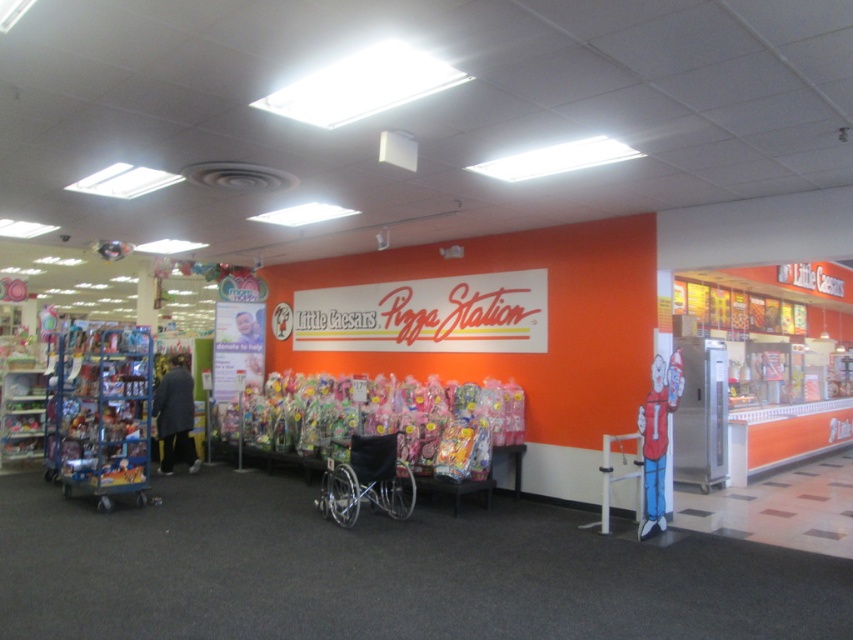
Which is more to the right, black plastic wheelchair at center or dark gray coat at left?

black plastic wheelchair at center

Does black plastic wheelchair at center appear on the right side of dark gray coat at left?

Correct, you'll find black plastic wheelchair at center to the right of dark gray coat at left.

Which is behind, point (334, 513) or point (183, 432)?

The point (183, 432) is behind.

You are a GUI agent. You are given a task and a screenshot of the screen. Output one action in this format:
    pyautogui.click(x=<x>, y=<y>)
    Task: Click on the black plastic wheelchair at center
    
    Given the screenshot: What is the action you would take?
    pyautogui.click(x=367, y=481)

Does translucent plastic toys at center have a larger size compared to dark gray coat at left?

Correct, translucent plastic toys at center is larger in size than dark gray coat at left.

Does point (347, 400) come in front of point (184, 460)?

Yes, point (347, 400) is closer to viewer.

Does point (450, 422) come in front of point (163, 444)?

That is True.

The height and width of the screenshot is (640, 853). In order to click on translucent plastic toys at center in this screenshot , I will do `click(389, 419)`.

Is translucent plastic toys at center thinner than black plastic wheelchair at center?

Incorrect, translucent plastic toys at center's width is not less than black plastic wheelchair at center's.

Can you confirm if translucent plastic toys at center is positioned below black plastic wheelchair at center?

A: No.

Which is behind, point (511, 392) or point (341, 474)?

Positioned behind is point (511, 392).

In order to click on translucent plastic toys at center in this screenshot , I will do (x=389, y=419).